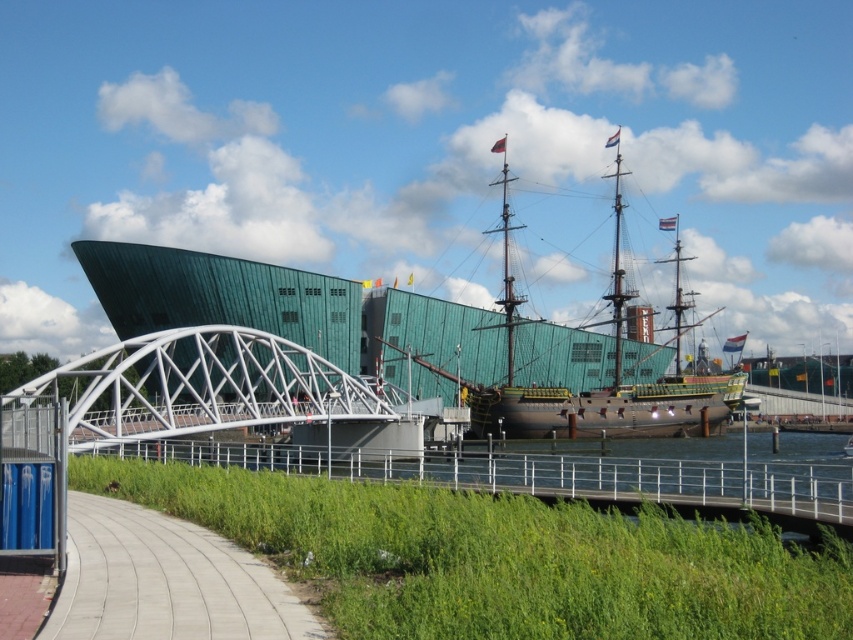
You are a tourist standing on the concrete sidewalk at lower left and want to cross to the other side of the water. Is the white metallic bridge at center located to the left or right of your current position?

The white metallic bridge at center is positioned on the left side of concrete sidewalk at lower left, so it is to your left.

Based on the photo, you are standing at the entrance of the ship and want to cross the water to the modern building. The white metallic bridge at center is your only option. Can you reach the bridge from your current position?

The white metallic bridge at center is located at coordinates (202, 387). Since you are at the ship entrance, which is near the waterfront, you can walk along the paved pathway curving along the water edge to reach the bridge at (202, 387).